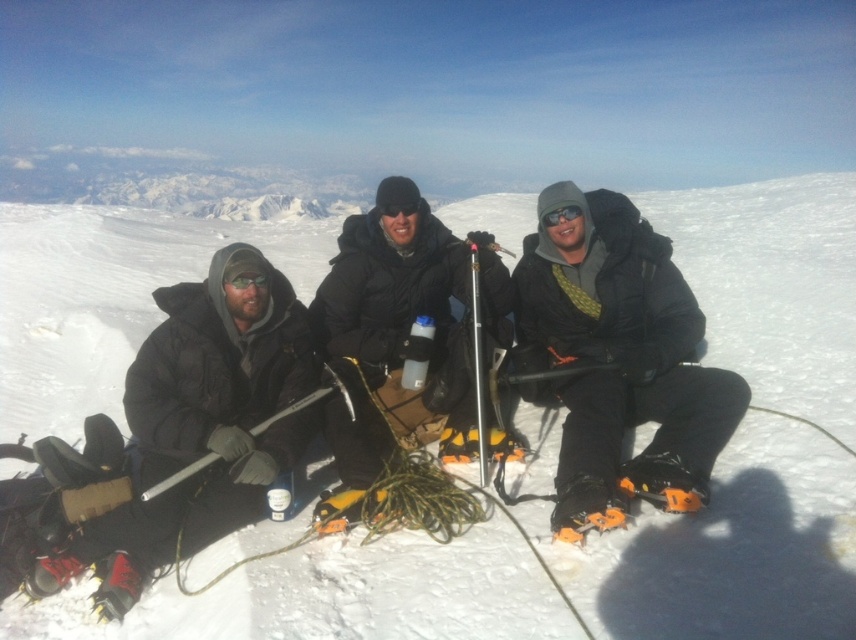
You are a photographer standing at the summit of a mountain. You want to capture a photo of the matte black jacket at center and the white powder snow at center. Which object will appear larger in the photo?

The white powder snow at center will appear larger in the photo because it is closer to the viewer than the matte black jacket at center.

You are planning to set up a tent on the snowy landscape. Considering the white powder snow at center and the matte black jacket at center, which object has a greater width and would provide more space for the tent foundation?

The white powder snow at center has a greater width than the matte black jacket at center, so it would provide more space for the tent foundation.